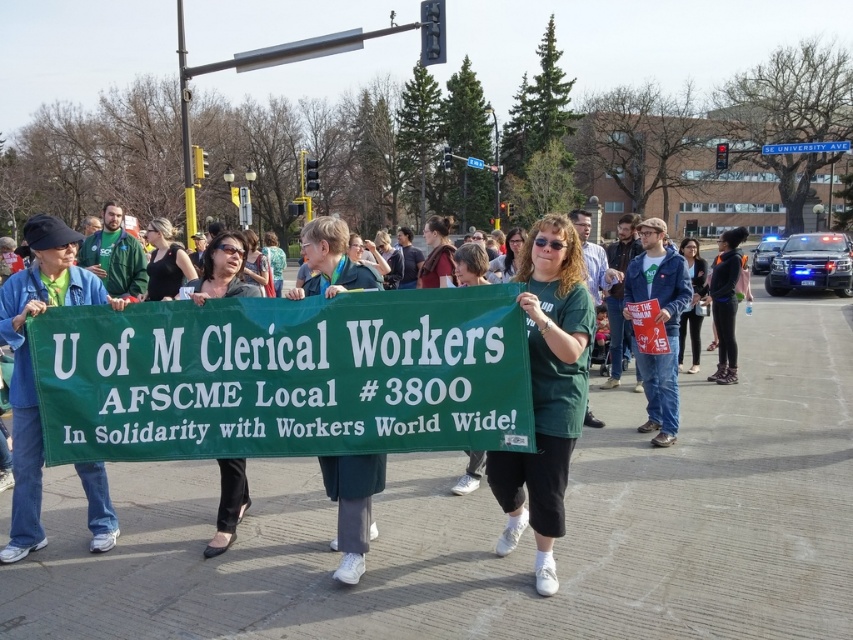
Is green fabric banner at center smaller than black fabric shirt at center?

Yes, green fabric banner at center is smaller than black fabric shirt at center.

Between green fabric banner at center and black fabric shirt at center, which one appears on the left side from the viewer's perspective?

From the viewer's perspective, black fabric shirt at center appears more on the left side.

Is point (215, 256) closer to viewer compared to point (183, 278)?

That is True.

I want to click on green fabric banner at center, so click(x=222, y=269).

Can you confirm if black fabric shirt at center is thinner than dark blue jeans at center?

No.

Is black fabric shirt at center smaller than dark blue jeans at center?

No.

The width and height of the screenshot is (853, 640). Describe the element at coordinates (165, 260) in the screenshot. I see `black fabric shirt at center` at that location.

Image resolution: width=853 pixels, height=640 pixels. I want to click on black fabric shirt at center, so click(x=165, y=260).

Is green fabric banner at center thinner than dark blue jeans at center?

Yes.

Is green fabric banner at center smaller than dark blue jeans at center?

Yes.

Find the location of `green fabric banner at center`. green fabric banner at center is located at coordinates (222, 269).